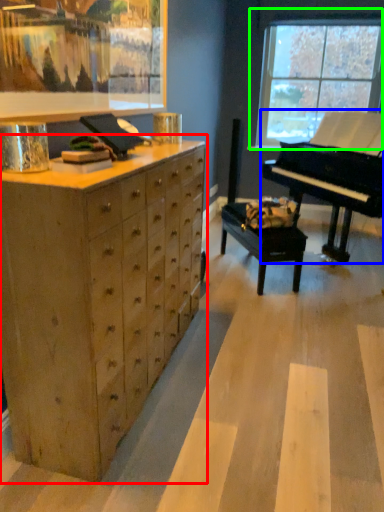
Question: Estimate the real-world distances between objects in this image. Which object is farther from chest of drawers (highlighted by a red box), piano (highlighted by a blue box) or window (highlighted by a green box)?

Choices:
 (A) piano
 (B) window

Answer: (B)